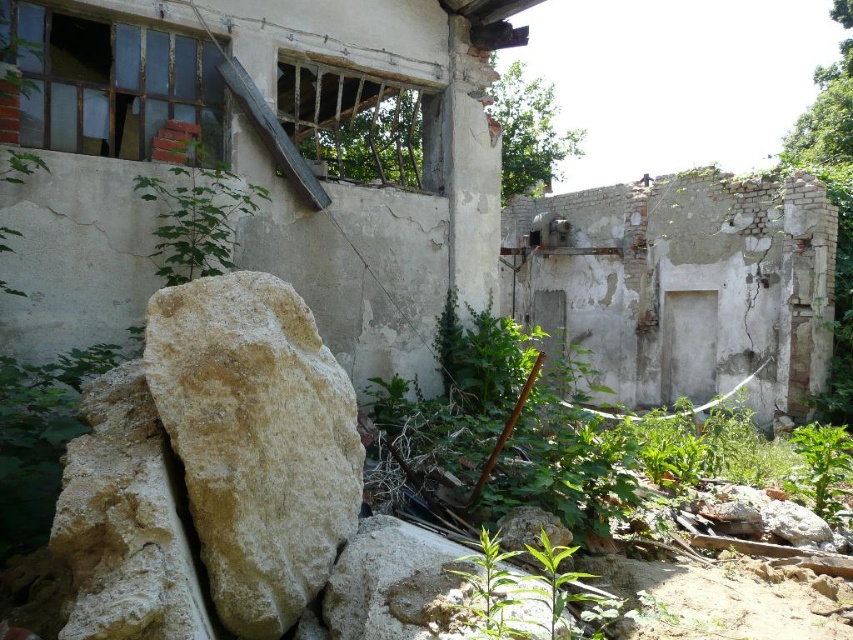
Does point (247, 333) come behind point (234, 202)?

No, (247, 333) is closer to viewer.

Locate an element on the screen. light beige stone at center is located at coordinates (254, 440).

Between light beige stone at center and green leafy plant at lower right, which one has more height?

Standing taller between the two is light beige stone at center.

Is light beige stone at center to the right of green leafy plant at lower right from the viewer's perspective?

No, light beige stone at center is not to the right of green leafy plant at lower right.

Is point (227, 556) closer to viewer compared to point (813, 432)?

Yes, point (227, 556) is closer to viewer.

Locate an element on the screen. The image size is (853, 640). light beige stone at center is located at coordinates (254, 440).

Does green leafy plant at upper left appear over green leafy plant at lower right?

Yes.

From the picture: Is green leafy plant at upper left positioned behind green leafy plant at lower right?

No, it is not.

The width and height of the screenshot is (853, 640). What do you see at coordinates (195, 214) in the screenshot?
I see `green leafy plant at upper left` at bounding box center [195, 214].

Image resolution: width=853 pixels, height=640 pixels. What are the coordinates of `green leafy plant at upper left` in the screenshot? It's located at (195, 214).